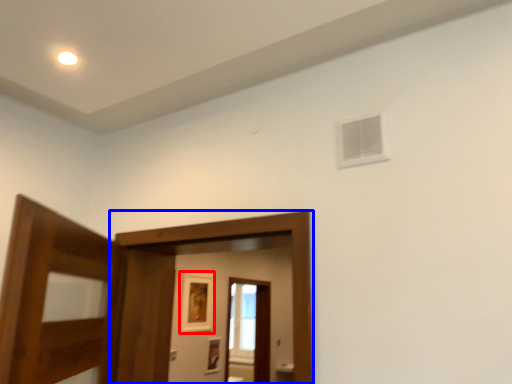
Question: Which object appears farthest to the camera in this image, picture frame (highlighted by a red box) or screen door (highlighted by a blue box)?

Choices:
 (A) picture frame
 (B) screen door

Answer: (A)